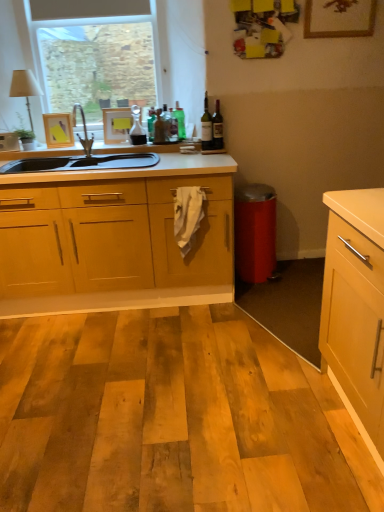
Question: From a real-world perspective, is translucent glass wine bottle at upper center, the second bottle from the right, positioned under matte white picture frame at upper center, marked as the second picture frame in a top-to-bottom arrangement, based on gravity?

Choices:
 (A) no
 (B) yes

Answer: (A)

Question: Considering the relative positions of translucent glass wine bottle at upper center, the second bottle from the right, and matte white picture frame at upper center, the 1th picture frame viewed from the back, in the image provided, is translucent glass wine bottle at upper center, the second bottle from the right, to the right of matte white picture frame at upper center, the 1th picture frame viewed from the back, from the viewer's perspective?

Choices:
 (A) yes
 (B) no

Answer: (A)

Question: Is translucent glass wine bottle at upper center, the second bottle from the right, positioned behind matte white picture frame at upper center, which is the second picture frame from left to right?

Choices:
 (A) no
 (B) yes

Answer: (A)

Question: Is translucent glass wine bottle at upper center, the second bottle from the right, beside matte white picture frame at upper center, the 1th picture frame viewed from the back?

Choices:
 (A) no
 (B) yes

Answer: (A)

Question: From the image's perspective, is translucent glass wine bottle at upper center, the second bottle from the right, located beneath matte white picture frame at upper center, the 1th picture frame viewed from the back?

Choices:
 (A) no
 (B) yes

Answer: (B)

Question: From the image's perspective, would you say translucent glass wine bottle at upper center, the third bottle viewed from the left, is positioned over matte white picture frame at upper center, arranged as the 3th picture frame when viewed from the front?

Choices:
 (A) yes
 (B) no

Answer: (B)

Question: Considering the relative positions of green glass bottle at upper center, which ranks as the 3th bottle in right-to-left order, and translucent glass wine bottle at upper center, the second bottle from the right, in the image provided, is green glass bottle at upper center, which ranks as the 3th bottle in right-to-left order, to the right of translucent glass wine bottle at upper center, the second bottle from the right, from the viewer's perspective?

Choices:
 (A) yes
 (B) no

Answer: (B)

Question: Is translucent glass wine bottle at upper center, the second bottle from the right, surrounded by green glass bottle at upper center, which ranks as the 3th bottle in right-to-left order?

Choices:
 (A) yes
 (B) no

Answer: (B)

Question: Does green glass bottle at upper center, the 2th bottle from the left, have a greater height compared to translucent glass wine bottle at upper center, the second bottle from the right?

Choices:
 (A) yes
 (B) no

Answer: (B)

Question: From a real-world perspective, is green glass bottle at upper center, the 2th bottle from the left, under translucent glass wine bottle at upper center, the third bottle viewed from the left?

Choices:
 (A) no
 (B) yes

Answer: (B)

Question: Can you confirm if green glass bottle at upper center, the 2th bottle from the left, is positioned to the left of translucent glass wine bottle at upper center, the third bottle viewed from the left?

Choices:
 (A) no
 (B) yes

Answer: (B)

Question: From the image's perspective, would you say green glass bottle at upper center, which ranks as the 3th bottle in right-to-left order, is positioned over translucent glass wine bottle at upper center, the third bottle viewed from the left?

Choices:
 (A) no
 (B) yes

Answer: (B)

Question: Considering the relative sizes of wooden picture frame at upper center, the third picture frame viewed from the back, and translucent glass carafe at center, positioned as the 1th bottle in left-to-right order, in the image provided, is wooden picture frame at upper center, the third picture frame viewed from the back, thinner than translucent glass carafe at center, positioned as the 1th bottle in left-to-right order,?

Choices:
 (A) yes
 (B) no

Answer: (A)